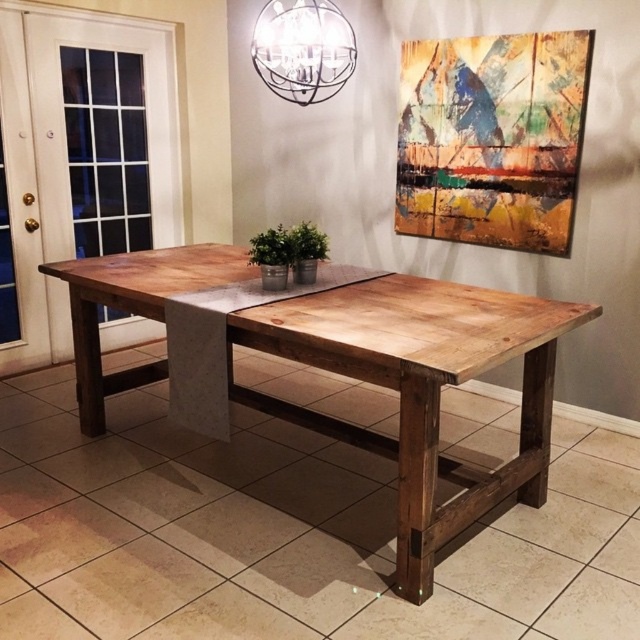
You are a painter standing in front of the wooden table at center and the metallic sphere at upper center. You want to place a tall painting on the surface of one of them. Which object can support the painting without it toppling over?

The wooden table at center is taller than the metallic sphere at upper center, so placing the tall painting on the wooden table at center would provide a stable base and prevent it from toppling over.

You are a delivery person who needs to place a package that is 1.5 meters long on the wooden table at center. Can you fit the package diagonally on the table without it touching the metallic sphere at upper center?

The wooden table at center is 1.65 meters away from the metallic sphere at upper center. Since the package is 1.5 meters long, placing it diagonally on the table would allow it to fit within the space between the table and the sphere. The distance between them is sufficient to accommodate the package without touching the metallic sphere at upper center.